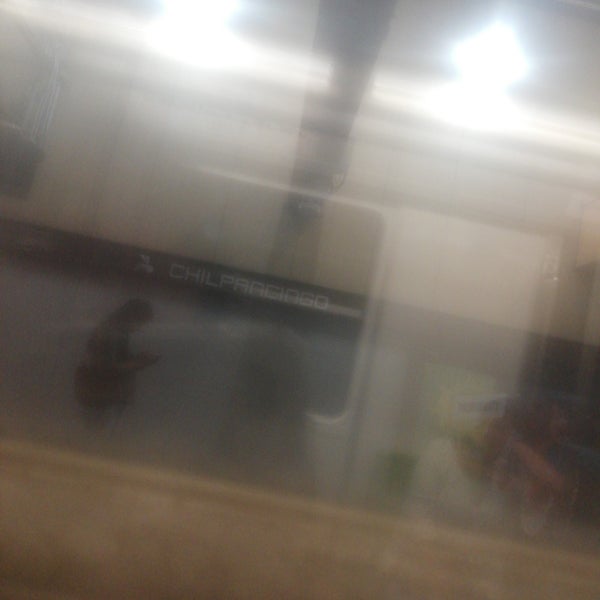
Locate an element on the screen. The height and width of the screenshot is (600, 600). wall is located at coordinates (262, 549).